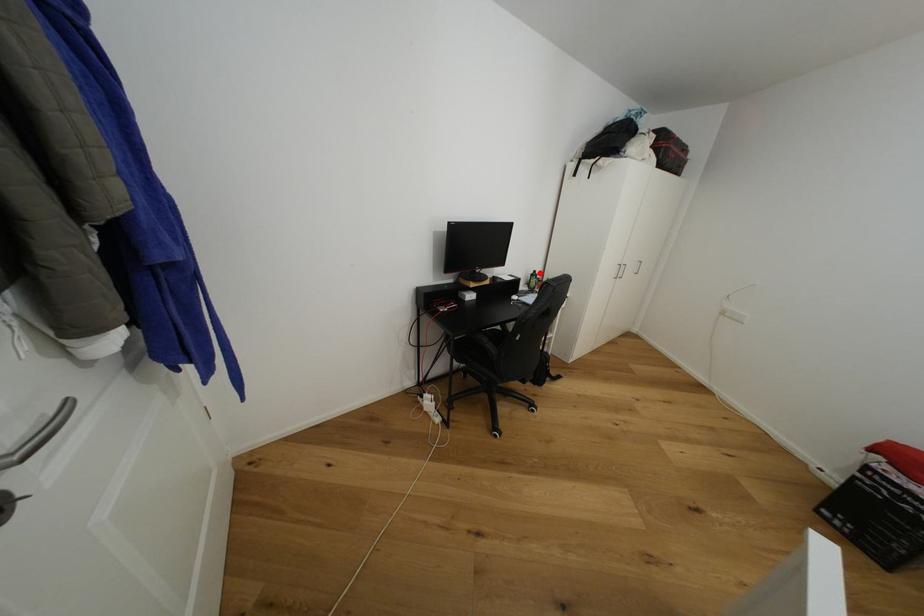
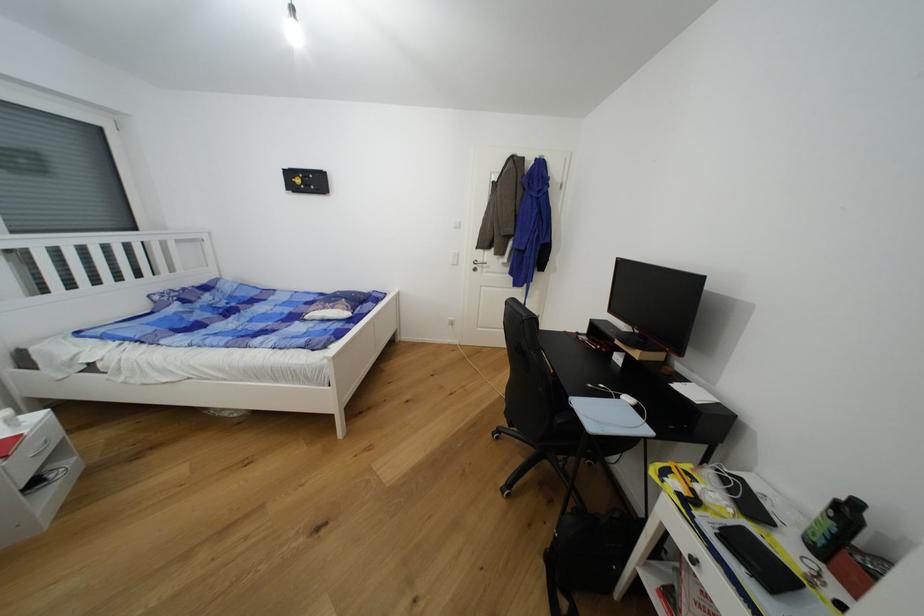
Find the pixel in the second image that matches the highlighted location in the first image.

(862, 506)